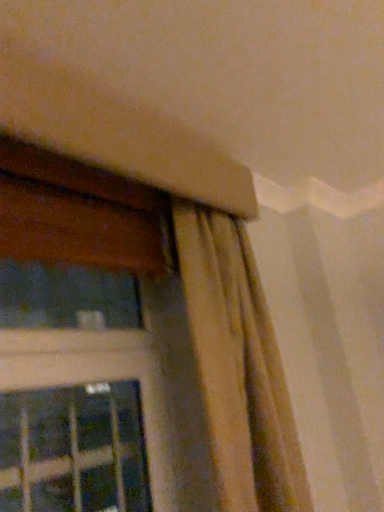
What do you see at coordinates (239, 366) in the screenshot?
I see `textured beige curtain at upper center` at bounding box center [239, 366].

You are a GUI agent. You are given a task and a screenshot of the screen. Output one action in this format:
    pyautogui.click(x=<x>, y=<y>)
    Task: Click on the textured beige curtain at upper center
    The height and width of the screenshot is (512, 384).
    Given the screenshot: What is the action you would take?
    pyautogui.click(x=239, y=366)

Identify the location of textured beige curtain at upper center. [x=239, y=366].